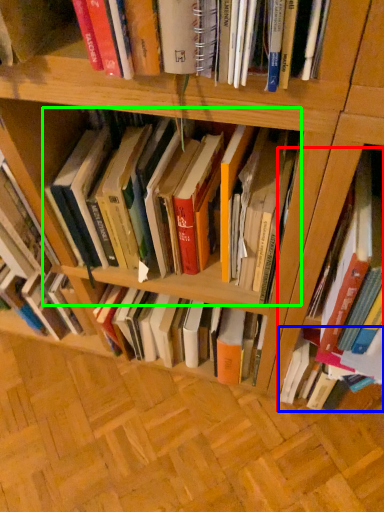
Question: Which object is positioned farthest from book (highlighted by a red box)? Select from book (highlighted by a blue box) and book (highlighted by a green box).

Choices:
 (A) book
 (B) book

Answer: (B)